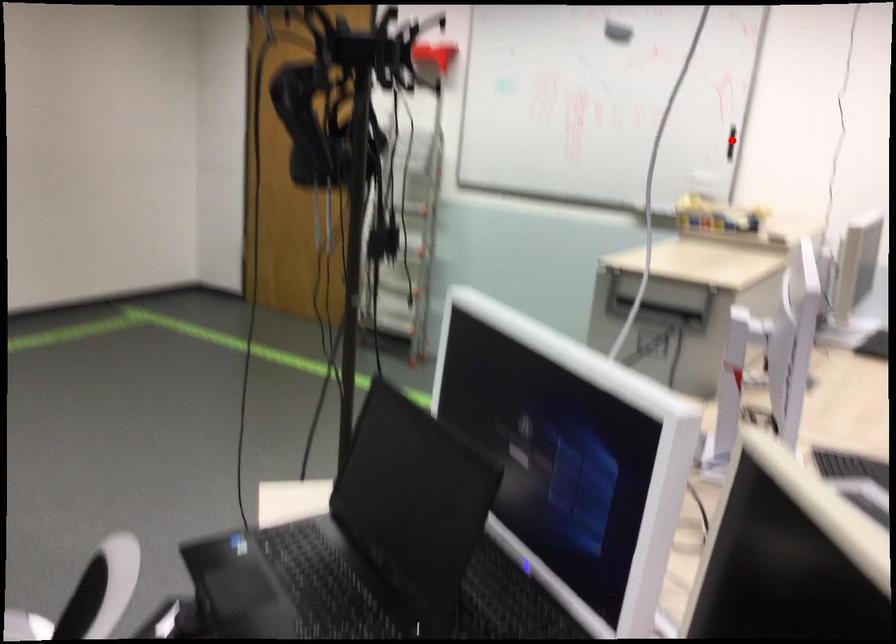
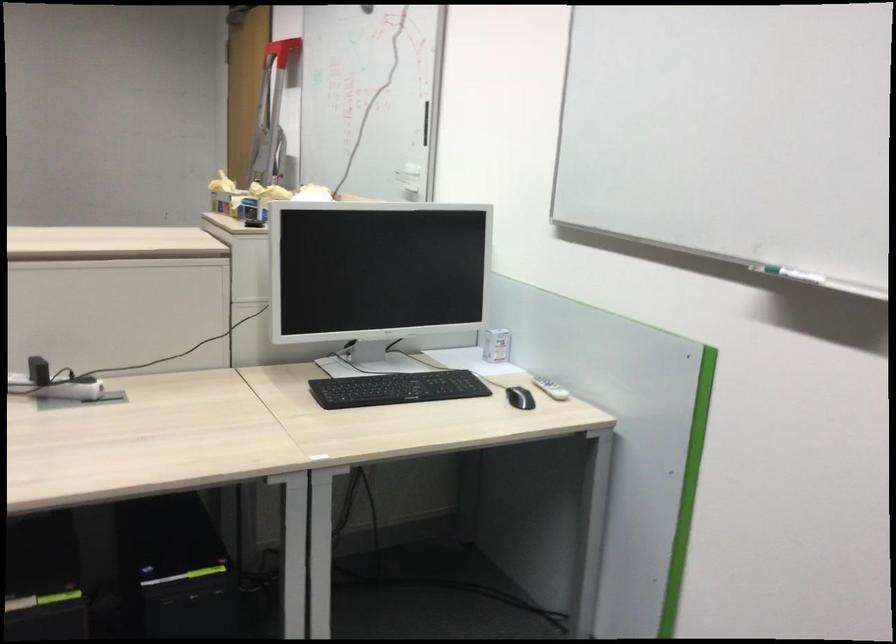
Question: I am providing you with two images of the same scene from different viewpoints. A red point is shown in image1. For the corresponding object point in image2, is it positioned nearer or farther from the camera?

Choices:
 (A) Nearer
 (B) Farther

Answer: (A)